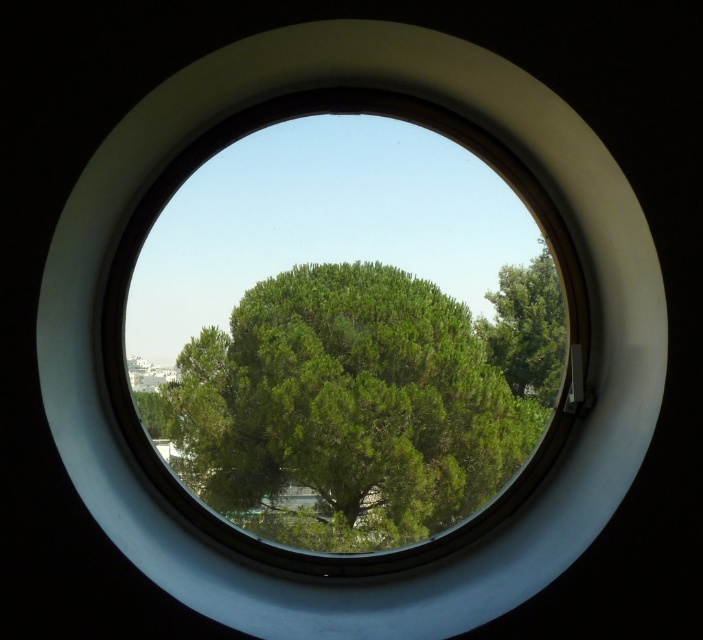
You are a drone operator planning to fly a drone between the green leafy tree at center and the green leafy tree at right. The drone has a maximum flight distance of 5 meters. Can the drone safely fly between them without exceeding its range?

The green leafy tree at center and green leafy tree at right are 4.73 meters apart, so the drone can safely fly between them as the distance is within its 5 meters maximum flight range.

You are an architect designing a new building and want to ensure that the green leafy tree at center and the green leafy tree at right are both visible through the circular window. Based on their heights, which tree will appear taller when viewed through the window?

The green leafy tree at right will appear taller when viewed through the window because it is taller than the green leafy tree at center according to the description.

You are an interior designer assessing the view from a circular window. You notice two green leafy trees outside. Which tree, the green leafy tree at center or the green leafy tree at right, appears smaller in the window?

The green leafy tree at center appears smaller because it occupies less space than the green leafy tree at right.